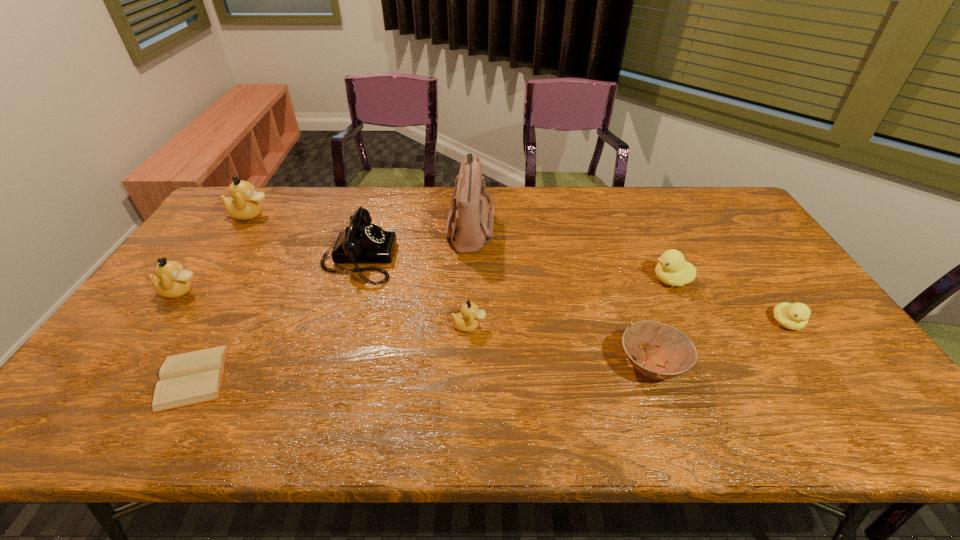
Where is `shoulder bag`? The height and width of the screenshot is (540, 960). shoulder bag is located at coordinates (469, 226).

Where is `the biggest tan duckling`? The height and width of the screenshot is (540, 960). the biggest tan duckling is located at coordinates (243, 204).

At what (x,y) coordinates should I click in order to perform the action: click on the farthest tan duckling. Please return your answer as a coordinate pair (x, y). The height and width of the screenshot is (540, 960). Looking at the image, I should click on (243, 204).

At what (x,y) coordinates should I click in order to perform the action: click on telephone. Please return your answer as a coordinate pair (x, y). Looking at the image, I should click on (362, 242).

The image size is (960, 540). I want to click on black telephone, so click(362, 242).

Where is `the second farthest tan duckling`? The height and width of the screenshot is (540, 960). the second farthest tan duckling is located at coordinates (171, 281).

Locate an element on the screen. The width and height of the screenshot is (960, 540). the left yellow duckling is located at coordinates (672, 269).

I want to click on the bigger yellow duckling, so click(672, 269).

I want to click on the nearest tan duckling, so click(x=467, y=320).

Locate an element on the screen. Image resolution: width=960 pixels, height=540 pixels. the third duckling from left to right is located at coordinates (467, 320).